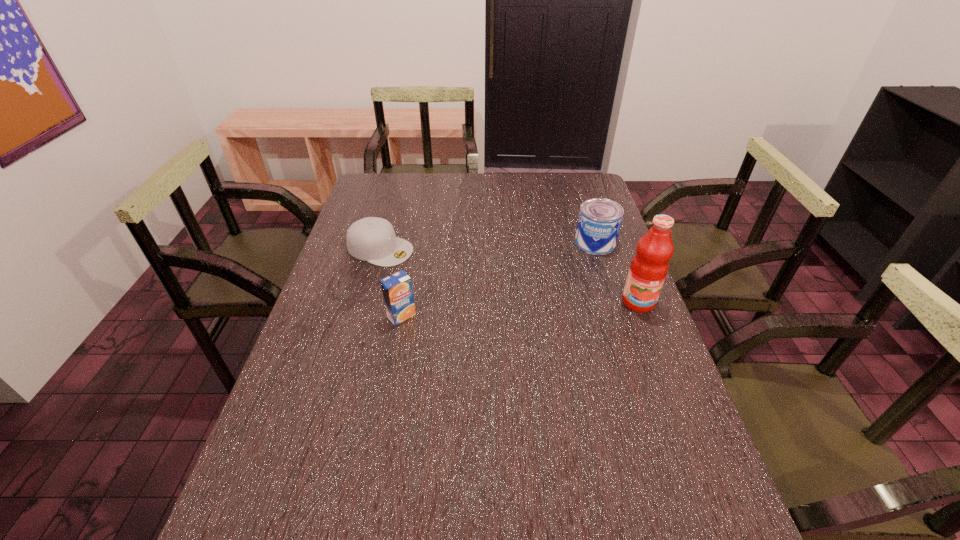
What are the coordinates of `empty space that is in between the tallest object and the orange_juice` in the screenshot? It's located at (519, 309).

Identify the location of free space between the can and the shortest object. (488, 246).

I want to click on vacant space that's between the tallest object and the cap, so click(509, 275).

Find the location of a particular element. empty location between the shortest object and the can is located at coordinates (488, 246).

Image resolution: width=960 pixels, height=540 pixels. I want to click on unoccupied area between the can and the cap, so click(488, 246).

You are a GUI agent. You are given a task and a screenshot of the screen. Output one action in this format:
    pyautogui.click(x=<x>, y=<y>)
    Task: Click on the empty location between the cap and the tallest object
    The width and height of the screenshot is (960, 540).
    Given the screenshot: What is the action you would take?
    [509, 275]

Choose which object is the nearest neighbor to the orange_juice. Please provide its 2D coordinates. Your answer should be formatted as a tuple, i.e. [(x, y)], where the tuple contains the x and y coordinates of a point satisfying the conditions above.

[(372, 239)]

The width and height of the screenshot is (960, 540). I want to click on object that ranks as the second closest to the orange_juice, so (599, 222).

Find the location of a particular element. free location that satisfies the following two spatial constraints: 1. on the back side of the can; 2. on the right side of the orange_juice is located at coordinates (415, 242).